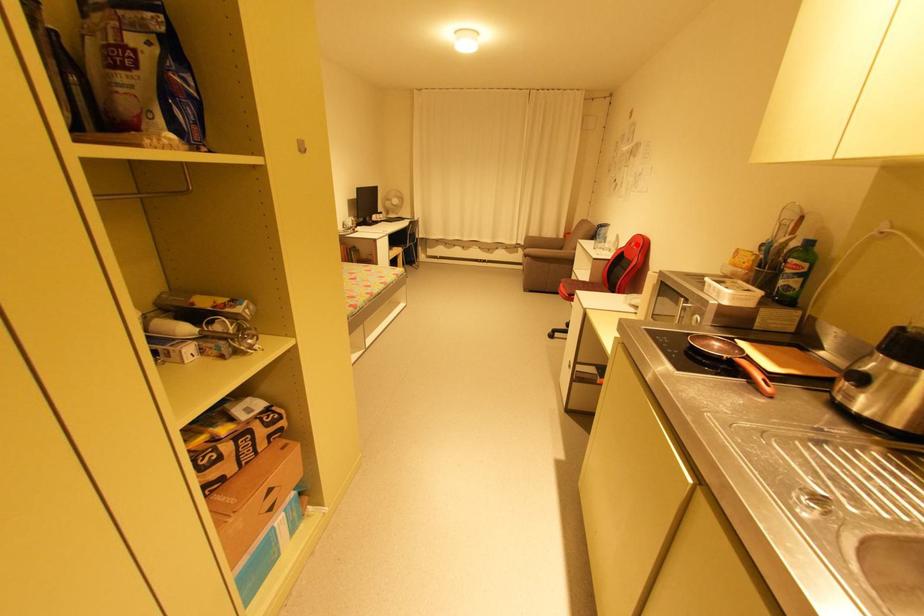
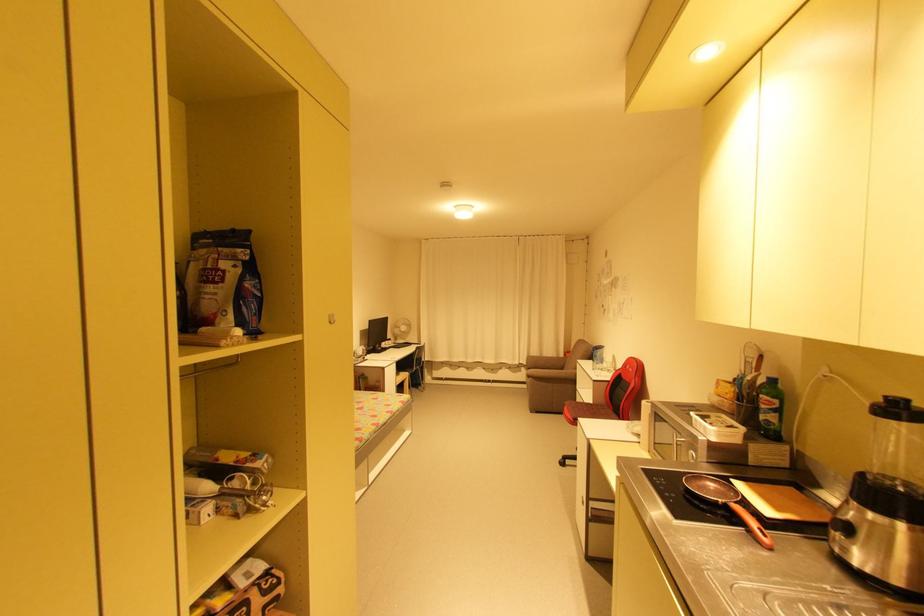
Question: I am providing you with two images of the same scene from different viewpoints. In image1, a red point is highlighted. Considering the same 3D point in image2, which of the following is correct?

Choices:
 (A) It is closer
 (B) It is farther

Answer: (B)